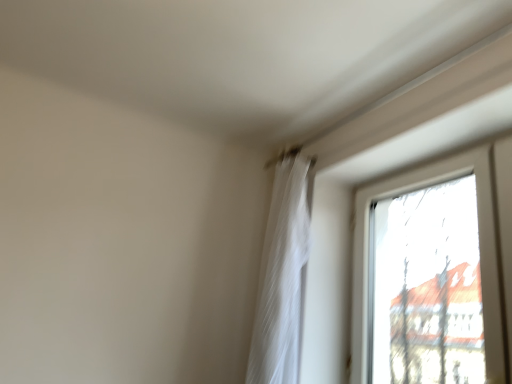
Measure the distance between white sheer curtain at upper center and camera.

white sheer curtain at upper center is 5.58 feet from camera.

Where is `white sheer curtain at upper center`? Image resolution: width=512 pixels, height=384 pixels. white sheer curtain at upper center is located at coordinates click(281, 278).

What is the approximate height of white sheer curtain at upper center?

The height of white sheer curtain at upper center is 3.40 feet.

This screenshot has width=512, height=384. What do you see at coordinates (281, 278) in the screenshot?
I see `white sheer curtain at upper center` at bounding box center [281, 278].

The height and width of the screenshot is (384, 512). What do you see at coordinates (480, 251) in the screenshot?
I see `transparent glass window at upper right` at bounding box center [480, 251].

This screenshot has height=384, width=512. Find the location of `transparent glass window at upper right`. transparent glass window at upper right is located at coordinates (x=480, y=251).

The image size is (512, 384). I want to click on white sheer curtain at upper center, so click(x=281, y=278).

Which object is positioned more to the right, white sheer curtain at upper center or transparent glass window at upper right?

From the viewer's perspective, transparent glass window at upper right appears more on the right side.

Based on the photo, relative to transparent glass window at upper right, is white sheer curtain at upper center in front or behind?

Clearly, white sheer curtain at upper center is behind transparent glass window at upper right.

Is point (257, 376) positioned in front of point (362, 236)?

Yes, point (257, 376) is in front of point (362, 236).

From the image's perspective, which one is positioned higher, white sheer curtain at upper center or transparent glass window at upper right?

white sheer curtain at upper center.

From a real-world perspective, between white sheer curtain at upper center and transparent glass window at upper right, who is vertically higher?

From a 3D spatial view, white sheer curtain at upper center is above.

Can you confirm if white sheer curtain at upper center is thinner than transparent glass window at upper right?

Incorrect, the width of white sheer curtain at upper center is not less than that of transparent glass window at upper right.

Is white sheer curtain at upper center shorter than transparent glass window at upper right?

In fact, white sheer curtain at upper center may be taller than transparent glass window at upper right.

Is white sheer curtain at upper center bigger or smaller than transparent glass window at upper right?

In the image, white sheer curtain at upper center appears to be smaller than transparent glass window at upper right.

Is white sheer curtain at upper center completely or partially outside of transparent glass window at upper right?

white sheer curtain at upper center is positioned outside transparent glass window at upper right.

Is white sheer curtain at upper center touching transparent glass window at upper right?

No, white sheer curtain at upper center is not beside transparent glass window at upper right.

Is transparent glass window at upper right at the back of white sheer curtain at upper center?

No, transparent glass window at upper right is not at the back of white sheer curtain at upper center.

What's the angular difference between white sheer curtain at upper center and transparent glass window at upper right's facing directions?

There is a 1.95-degree angle between the facing directions of white sheer curtain at upper center and transparent glass window at upper right.

Locate an element on the screen. The height and width of the screenshot is (384, 512). curtain behind the transparent glass window at upper right is located at coordinates (281, 278).

Considering the positions of objects transparent glass window at upper right and white sheer curtain at upper center in the image provided, who is more to the right, transparent glass window at upper right or white sheer curtain at upper center?

transparent glass window at upper right.

In the scene shown: Considering their positions, is transparent glass window at upper right located in front of or behind white sheer curtain at upper center?

In the image, transparent glass window at upper right appears in front of white sheer curtain at upper center.

Which is in front, point (400, 193) or point (289, 206)?

Point (400, 193)

From the image's perspective, between transparent glass window at upper right and white sheer curtain at upper center, who is located below?

transparent glass window at upper right appears lower in the image.

From a real-world perspective, is transparent glass window at upper right positioned above or below white sheer curtain at upper center?

From a real-world perspective, transparent glass window at upper right is physically below white sheer curtain at upper center.

Can you confirm if transparent glass window at upper right is wider than white sheer curtain at upper center?

Incorrect, the width of transparent glass window at upper right does not surpass that of white sheer curtain at upper center.

In terms of height, does transparent glass window at upper right look taller or shorter compared to white sheer curtain at upper center?

transparent glass window at upper right is shorter than white sheer curtain at upper center.

Is transparent glass window at upper right smaller than white sheer curtain at upper center?

Incorrect, transparent glass window at upper right is not smaller in size than white sheer curtain at upper center.

Choose the correct answer: Is transparent glass window at upper right inside white sheer curtain at upper center or outside it?

transparent glass window at upper right is not enclosed by white sheer curtain at upper center.

Would you consider transparent glass window at upper right to be distant from white sheer curtain at upper center?

That's not correct — transparent glass window at upper right is a little close to white sheer curtain at upper center.

Is transparent glass window at upper right positioned with its back to white sheer curtain at upper center?

That's not correct — transparent glass window at upper right is not looking away from white sheer curtain at upper center.

Can you tell me how much transparent glass window at upper right and white sheer curtain at upper center differ in facing direction?

transparent glass window at upper right and white sheer curtain at upper center are facing 1.95 degrees away from each other.

Image resolution: width=512 pixels, height=384 pixels. What are the coordinates of `window that is on the right side of white sheer curtain at upper center` in the screenshot? It's located at (480, 251).

Identify the location of curtain behind the transparent glass window at upper right. (281, 278).

In order to click on curtain above the transparent glass window at upper right (from the image's perspective) in this screenshot , I will do `click(281, 278)`.